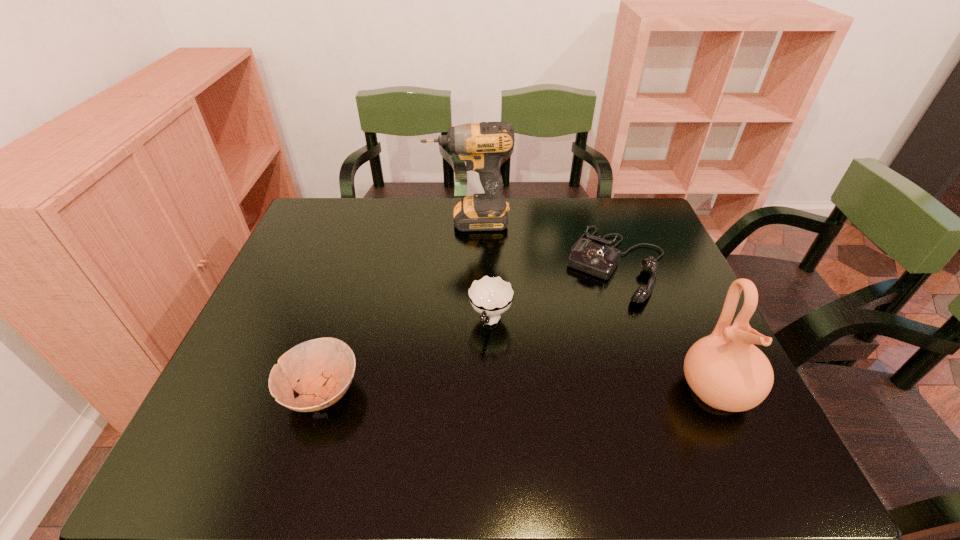
Where is `vacant space on the desktop that is between the leftmost object and the second tallest object and is positioned on the side of the cup with the handle`? The height and width of the screenshot is (540, 960). vacant space on the desktop that is between the leftmost object and the second tallest object and is positioned on the side of the cup with the handle is located at coordinates (468, 391).

Locate an element on the screen. vacant spot on the desktop that is between the shortest object and the fourth shortest object and is positioned on the dial of the telephone is located at coordinates (546, 391).

You are a GUI agent. You are given a task and a screenshot of the screen. Output one action in this format:
    pyautogui.click(x=<x>, y=<y>)
    Task: Click on the vacant space on the desktop that is between the shortest object and the pottery and is positioned with the drill bit of the tallest object facing forward
    This screenshot has height=540, width=960.
    Given the screenshot: What is the action you would take?
    pyautogui.click(x=477, y=391)